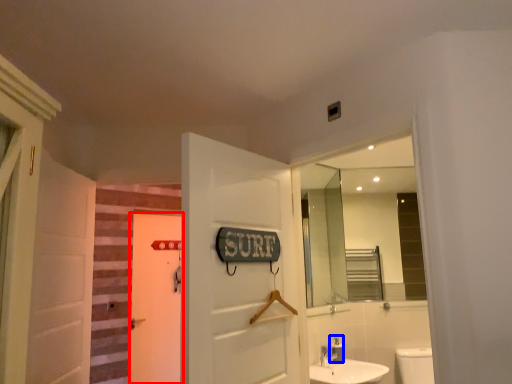
Question: Among these objects, which one is farthest to the camera, door (highlighted by a red box) or toiletry (highlighted by a blue box)?

Choices:
 (A) door
 (B) toiletry

Answer: (A)